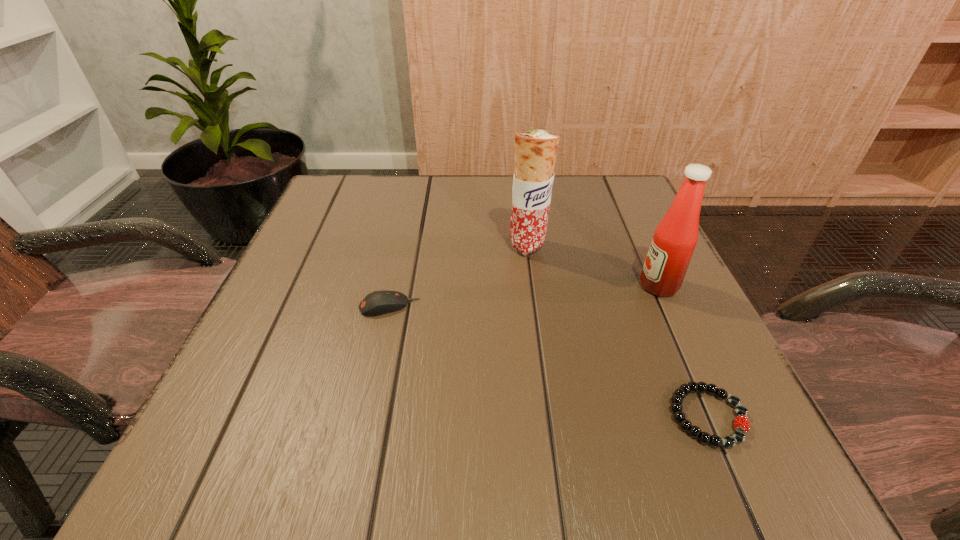
Identify the location of vacant space at the right edge of the desktop. (646, 324).

This screenshot has width=960, height=540. Find the location of `vacant space at the far right corner`. vacant space at the far right corner is located at coordinates (584, 183).

You are a GUI agent. You are given a task and a screenshot of the screen. Output one action in this format:
    pyautogui.click(x=<x>, y=<y>)
    Task: Click on the vacant space that is in between the nearest object and the computer mouse
    This screenshot has width=960, height=540.
    Given the screenshot: What is the action you would take?
    pyautogui.click(x=549, y=361)

The height and width of the screenshot is (540, 960). In order to click on vacant space in between the third tallest object and the burrito in this screenshot , I will do `click(459, 276)`.

In order to click on empty space between the nearest object and the condiment in this screenshot , I will do `click(684, 351)`.

Image resolution: width=960 pixels, height=540 pixels. Find the location of `free space between the nearest object and the third tallest object`. free space between the nearest object and the third tallest object is located at coordinates (549, 361).

Locate an element on the screen. The image size is (960, 540). vacant region between the condiment and the nearest object is located at coordinates (684, 351).

The image size is (960, 540). Identify the location of free space between the condiment and the leftmost object. (524, 296).

Identify the location of blank region between the condiment and the leftmost object. (524, 296).

The height and width of the screenshot is (540, 960). I want to click on free space between the burrito and the leftmost object, so click(459, 276).